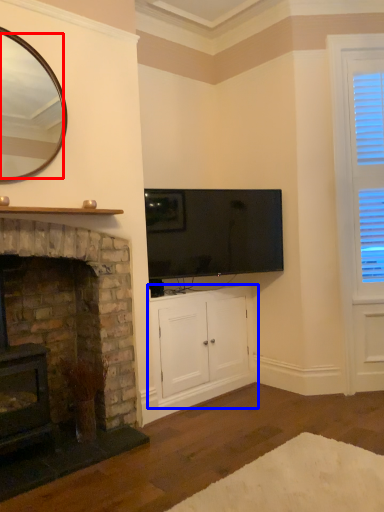
Question: Which object appears farthest to the camera in this image, mirror (highlighted by a red box) or cabinetry (highlighted by a blue box)?

Choices:
 (A) mirror
 (B) cabinetry

Answer: (B)